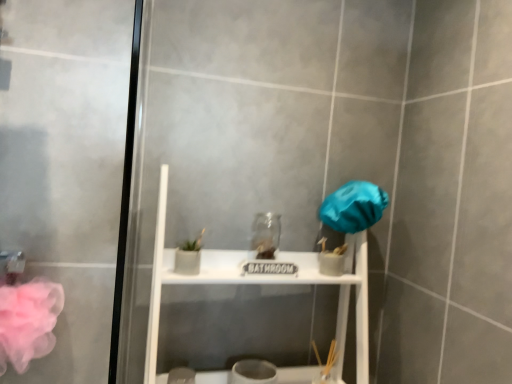
What do you see at coordinates (262, 283) in the screenshot? The image size is (512, 384). I see `white glossy shelf at center` at bounding box center [262, 283].

Where is `white glossy shelf at center`? white glossy shelf at center is located at coordinates (262, 283).

Locate an element on the screen. This screenshot has width=512, height=384. white glossy shelf at center is located at coordinates click(x=262, y=283).